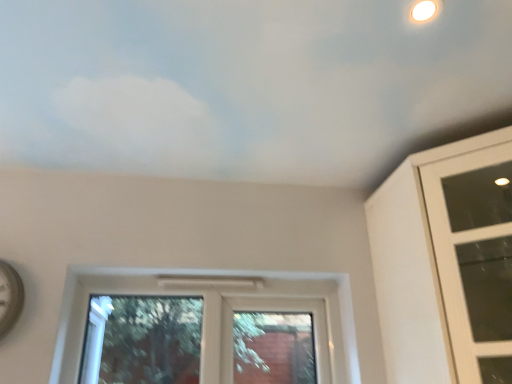
What do you see at coordinates (219, 312) in the screenshot?
I see `clear glass window at center, the 1th window viewed from the left` at bounding box center [219, 312].

This screenshot has height=384, width=512. Describe the element at coordinates (247, 85) in the screenshot. I see `white matte cloud at upper center` at that location.

Image resolution: width=512 pixels, height=384 pixels. What do you see at coordinates (474, 258) in the screenshot?
I see `white glass window at upper right, arranged as the first window when viewed from the right` at bounding box center [474, 258].

This screenshot has width=512, height=384. I want to click on clear glass window at center, marked as the 2th window in a right-to-left arrangement, so click(x=219, y=312).

Is white glass window at upper right, arranged as the first window when viewed from the right, aimed at white matte cloud at upper center?

No, white glass window at upper right, arranged as the first window when viewed from the right, does not turn towards white matte cloud at upper center.

Is white glass window at upper right, acting as the second window starting from the left, far away from white matte cloud at upper center?

That's not correct — white glass window at upper right, acting as the second window starting from the left, is a little close to white matte cloud at upper center.

From the image's perspective, is white glass window at upper right, arranged as the first window when viewed from the right, on top of white matte cloud at upper center?

Incorrect, from the image's perspective, white glass window at upper right, arranged as the first window when viewed from the right, is lower than white matte cloud at upper center.

In the image, is white glass window at upper right, arranged as the first window when viewed from the right, on the left side or the right side of white matte cloud at upper center?

Based on their positions, white glass window at upper right, arranged as the first window when viewed from the right, is located to the right of white matte cloud at upper center.

Between white matte cloud at upper center and clear glass window at center, the 1th window viewed from the left, which one has smaller width?

With smaller width is clear glass window at center, the 1th window viewed from the left.

Does white matte cloud at upper center lie in front of clear glass window at center, marked as the 2th window in a right-to-left arrangement?

Yes, white matte cloud at upper center is in front of clear glass window at center, marked as the 2th window in a right-to-left arrangement.

Is white matte cloud at upper center with clear glass window at center, marked as the 2th window in a right-to-left arrangement?

No, white matte cloud at upper center is not making contact with clear glass window at center, marked as the 2th window in a right-to-left arrangement.

Is there a large distance between clear glass window at center, marked as the 2th window in a right-to-left arrangement, and white glass window at upper right, arranged as the first window when viewed from the right?

That's not correct — clear glass window at center, marked as the 2th window in a right-to-left arrangement, is a little close to white glass window at upper right, arranged as the first window when viewed from the right.

Is clear glass window at center, marked as the 2th window in a right-to-left arrangement, facing towards white glass window at upper right, arranged as the first window when viewed from the right?

No, clear glass window at center, marked as the 2th window in a right-to-left arrangement, is not aimed at white glass window at upper right, arranged as the first window when viewed from the right.

Find the location of a particular element. This screenshot has width=512, height=384. window lying on the left of white glass window at upper right, acting as the second window starting from the left is located at coordinates (219, 312).

Is clear glass window at center, the 1th window viewed from the left, inside the boundaries of white glass window at upper right, acting as the second window starting from the left, or outside?

clear glass window at center, the 1th window viewed from the left, is not enclosed by white glass window at upper right, acting as the second window starting from the left.

Is white glass window at upper right, arranged as the first window when viewed from the right, further to camera compared to clear glass window at center, the 1th window viewed from the left?

No, white glass window at upper right, arranged as the first window when viewed from the right, is in front of clear glass window at center, the 1th window viewed from the left.

Which of these two, white glass window at upper right, acting as the second window starting from the left, or clear glass window at center, the 1th window viewed from the left, stands taller?

With more height is white glass window at upper right, acting as the second window starting from the left.

Would you say white glass window at upper right, arranged as the first window when viewed from the right, is inside or outside clear glass window at center, marked as the 2th window in a right-to-left arrangement?

white glass window at upper right, arranged as the first window when viewed from the right, lies outside clear glass window at center, marked as the 2th window in a right-to-left arrangement.

Is clear glass window at center, the 1th window viewed from the left, to the left or to the right of white matte cloud at upper center in the image?

Clearly, clear glass window at center, the 1th window viewed from the left, is on the left of white matte cloud at upper center in the image.

Does point (331, 349) come in front of point (165, 7)?

No, (331, 349) is further to viewer.

Consider the image. Does clear glass window at center, the 1th window viewed from the left, turn towards white matte cloud at upper center?

No, clear glass window at center, the 1th window viewed from the left, does not turn towards white matte cloud at upper center.

Can you confirm if clear glass window at center, the 1th window viewed from the left, is smaller than white matte cloud at upper center?

Yes.

You are a GUI agent. You are given a task and a screenshot of the screen. Output one action in this format:
    pyautogui.click(x=<x>, y=<y>)
    Task: Click on the 1st window below the white matte cloud at upper center (from the image's perspective)
    
    Given the screenshot: What is the action you would take?
    pyautogui.click(x=474, y=258)

Is point (70, 154) positioned in front of point (438, 206)?

No, (70, 154) is behind (438, 206).

Which of these two, white matte cloud at upper center or white glass window at upper right, acting as the second window starting from the left, is bigger?

white glass window at upper right, acting as the second window starting from the left.

Find the location of `cloud on the left side of white glass window at upper right, acting as the second window starting from the left`. cloud on the left side of white glass window at upper right, acting as the second window starting from the left is located at coordinates (247, 85).

Locate an element on the screen. cloud in front of the clear glass window at center, marked as the 2th window in a right-to-left arrangement is located at coordinates (247, 85).

Estimate the real-world distances between objects in this image. Which object is closer to white matte cloud at upper center, white glass window at upper right, acting as the second window starting from the left, or clear glass window at center, the 1th window viewed from the left?

white glass window at upper right, acting as the second window starting from the left.

Estimate the real-world distances between objects in this image. Which object is further from white matte cloud at upper center, clear glass window at center, the 1th window viewed from the left, or white glass window at upper right, arranged as the first window when viewed from the right?

The object further to white matte cloud at upper center is clear glass window at center, the 1th window viewed from the left.

From the image, which object appears to be nearer to white glass window at upper right, acting as the second window starting from the left, white matte cloud at upper center or clear glass window at center, marked as the 2th window in a right-to-left arrangement?

white matte cloud at upper center.

Looking at the image, which one is located further to clear glass window at center, the 1th window viewed from the left, white matte cloud at upper center or white glass window at upper right, acting as the second window starting from the left?

white matte cloud at upper center.

Considering their positions, is white glass window at upper right, arranged as the first window when viewed from the right, positioned closer to clear glass window at center, the 1th window viewed from the left, than white matte cloud at upper center?

Among the two, white glass window at upper right, arranged as the first window when viewed from the right, is located nearer to clear glass window at center, the 1th window viewed from the left.

Estimate the real-world distances between objects in this image. Which object is further from white glass window at upper right, arranged as the first window when viewed from the right, clear glass window at center, marked as the 2th window in a right-to-left arrangement, or white matte cloud at upper center?

clear glass window at center, marked as the 2th window in a right-to-left arrangement, is positioned further to the anchor white glass window at upper right, arranged as the first window when viewed from the right.

At what (x,y) coordinates should I click in order to perform the action: click on cloud between clear glass window at center, the 1th window viewed from the left, and white glass window at upper right, acting as the second window starting from the left, from left to right. Please return your answer as a coordinate pair (x, y). This screenshot has height=384, width=512. Looking at the image, I should click on (247, 85).